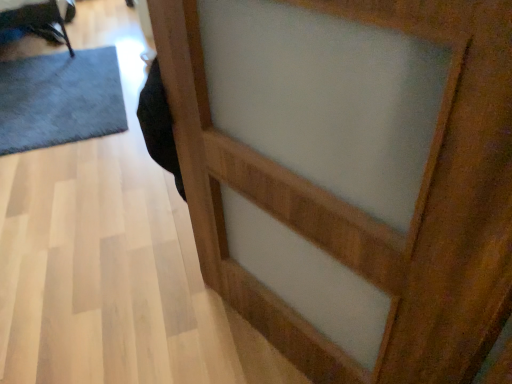
Question: In terms of width, does dark gray carpet at left look wider or thinner when compared to wooden barn door at center?

Choices:
 (A) wide
 (B) thin

Answer: (A)

Question: Is point (117, 64) positioned closer to the camera than point (484, 157)?

Choices:
 (A) farther
 (B) closer

Answer: (A)

Question: From a real-world perspective, is dark gray carpet at left physically located above or below wooden barn door at center?

Choices:
 (A) above
 (B) below

Answer: (B)

Question: From the image's perspective, is wooden barn door at center located above or below dark gray carpet at left?

Choices:
 (A) above
 (B) below

Answer: (B)

Question: Based on their sizes in the image, would you say wooden barn door at center is bigger or smaller than dark gray carpet at left?

Choices:
 (A) small
 (B) big

Answer: (A)

Question: Is wooden barn door at center inside or outside of dark gray carpet at left?

Choices:
 (A) outside
 (B) inside

Answer: (A)

Question: From a real-world perspective, is wooden barn door at center above or below dark gray carpet at left?

Choices:
 (A) below
 (B) above

Answer: (B)